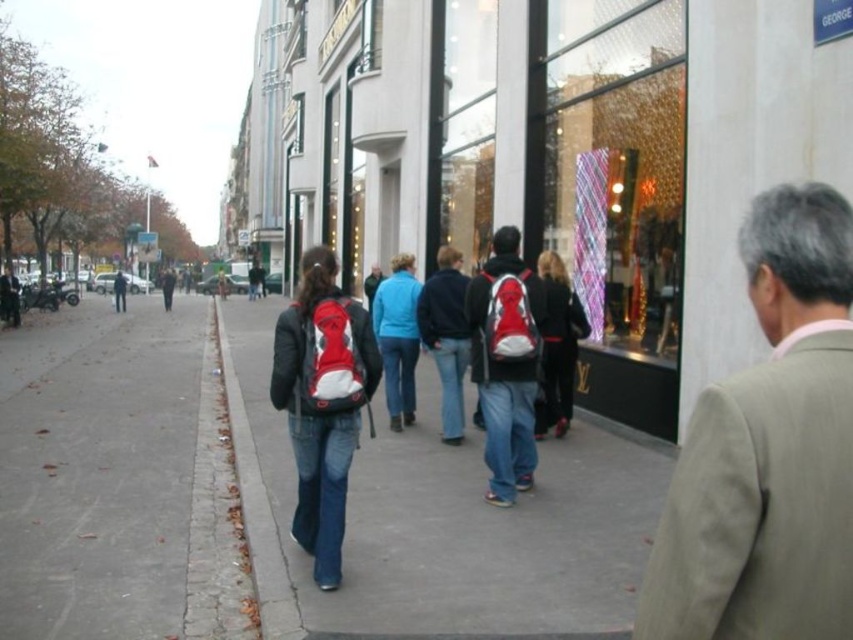
You are standing at the point marked as point (167,339) in the image. If you walk 20 meters towards the camera, will you be closer to the camera than 3 meters?

The distance of point (167,339) from camera is 23.09 meters. If you walk 20 meters towards the camera, you will be 23.09 minus 20 equals 3.09 meters away from the camera. Therefore, you will be just over 3 meters away, so no, you won not be closer than 3 meters.

You are standing at the center of the street and see a light brown suit at right and a denim jacket at center. Which clothing item is farther from you?

The light brown suit at right is farther from you since it is 41.81 meters away from the denim jacket at center, which is closer to your position.

In the scene shown: You are standing on the sidewalk in the urban street scene and want to walk towards the point at coordinates point (461, 394). There is an obstacle at point (50, 404). Will you encounter the obstacle before reaching your destination?

Yes, you will encounter the obstacle at point (50, 404) before reaching the destination at point (461, 394) because point (50, 404) is closer to the viewer than point (461, 394).